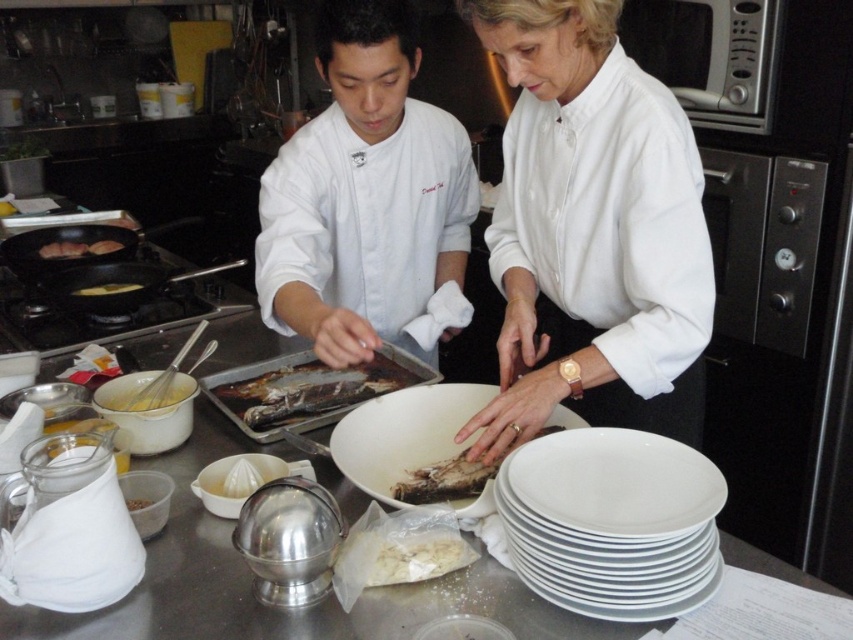
Who is taller, smooth white shirt at center or brown matte fish at center?

With more height is smooth white shirt at center.

Locate an element on the screen. Image resolution: width=853 pixels, height=640 pixels. smooth white shirt at center is located at coordinates (592, 230).

This screenshot has height=640, width=853. In order to click on smooth white shirt at center in this screenshot , I will do `click(592, 230)`.

Can you confirm if white matte chef coat at center is positioned above yellow matte fish at left?

Correct, white matte chef coat at center is located above yellow matte fish at left.

Which is in front, point (335, 227) or point (126, 285)?

Point (335, 227) is more forward.

Locate an element on the screen. white matte chef coat at center is located at coordinates tap(364, 195).

The height and width of the screenshot is (640, 853). What do you see at coordinates (612, 522) in the screenshot?
I see `white glossy plate at lower right` at bounding box center [612, 522].

Which is above, white glossy plate at lower right or white matte plate at center?

white matte plate at center is above.

Between point (579, 524) and point (405, 390), which one is positioned behind?

The point (405, 390) is behind.

I want to click on white glossy plate at lower right, so click(612, 522).